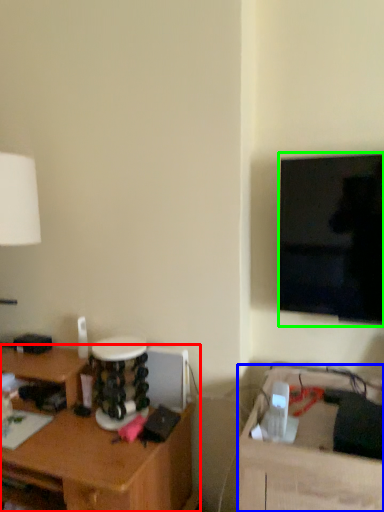
Question: Based on their relative distances, which object is farther from desk (highlighted by a red box)? Choose from table (highlighted by a blue box) and television (highlighted by a green box).

Choices:
 (A) table
 (B) television

Answer: (B)